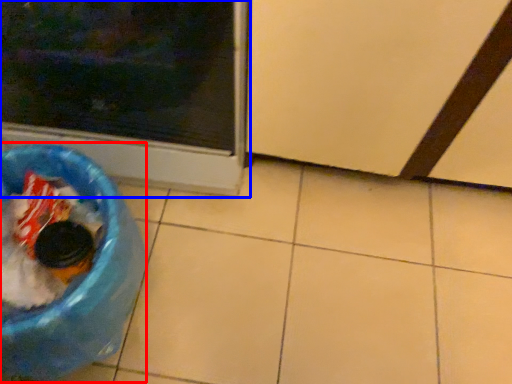
Question: Which object appears farthest to the camera in this image, recycling bin (highlighted by a red box) or home appliance (highlighted by a blue box)?

Choices:
 (A) recycling bin
 (B) home appliance

Answer: (A)